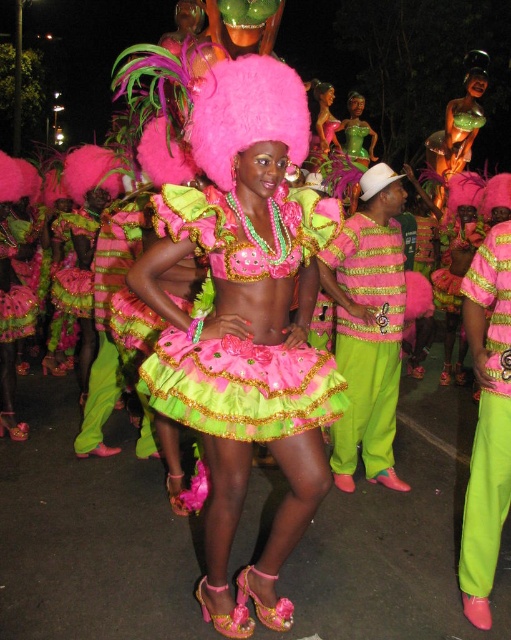
You are a photographer at the carnival and want to capture the matte pink fabric dress at center in your shot. According to the coordinates provided, where should you aim your camera to ensure the dress is centered in your frame?

You should aim your camera at point (242, 387) to center the matte pink fabric dress at center in your frame.

You are a photographer at the carnival. You want to take a photo of the shiny satin dress at center and neon green satin pants at lower right. Which object should you focus on first if you want to capture both in the same frame without moving the camera?

The shiny satin dress at center is above the neon green satin pants at lower right, so you should focus on the shiny satin dress at center first to ensure both are in the frame.